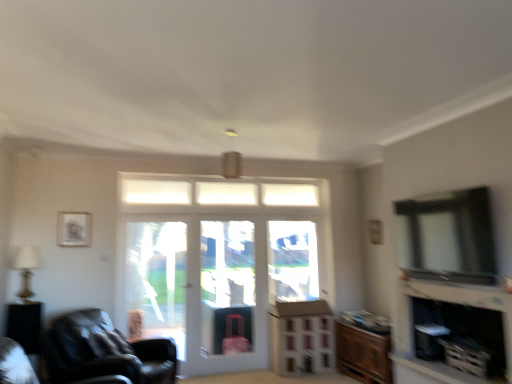
Question: Is transparent glass window at upper right wider than leather black chair at lower left, acting as the second chair starting from the front?

Choices:
 (A) yes
 (B) no

Answer: (B)

Question: Considering the relative sizes of transparent glass window at upper right and leather black chair at lower left, which is the 1th chair from back to front, in the image provided, is transparent glass window at upper right smaller than leather black chair at lower left, which is the 1th chair from back to front,?

Choices:
 (A) yes
 (B) no

Answer: (A)

Question: Considering the relative sizes of transparent glass window at upper right and leather black chair at lower left, acting as the second chair starting from the front, in the image provided, is transparent glass window at upper right taller than leather black chair at lower left, acting as the second chair starting from the front,?

Choices:
 (A) yes
 (B) no

Answer: (B)

Question: Is transparent glass window at upper right bigger than leather black chair at lower left, acting as the second chair starting from the front?

Choices:
 (A) no
 (B) yes

Answer: (A)

Question: Does transparent glass window at upper right appear on the left side of leather black chair at lower left, which is the 1th chair from back to front?

Choices:
 (A) no
 (B) yes

Answer: (A)

Question: Can you confirm if transparent glass window at upper right is thinner than leather black chair at lower left, acting as the second chair starting from the front?

Choices:
 (A) no
 (B) yes

Answer: (B)

Question: Is black glossy side table at lower left inside matte silver lamp at left?

Choices:
 (A) no
 (B) yes

Answer: (A)

Question: From the image's perspective, is matte silver lamp at left located above black glossy side table at lower left?

Choices:
 (A) yes
 (B) no

Answer: (A)

Question: Is black glossy side table at lower left at the back of matte silver lamp at left?

Choices:
 (A) yes
 (B) no

Answer: (B)

Question: From the image's perspective, is matte silver lamp at left under black glossy side table at lower left?

Choices:
 (A) yes
 (B) no

Answer: (B)

Question: Is matte silver lamp at left wider than black glossy side table at lower left?

Choices:
 (A) no
 (B) yes

Answer: (B)

Question: From a real-world perspective, is matte silver lamp at left below black glossy side table at lower left?

Choices:
 (A) no
 (B) yes

Answer: (A)

Question: From the image's perspective, would you say brown cardboard dresser at lower center is shown under matte black fireplace at lower right?

Choices:
 (A) no
 (B) yes

Answer: (B)